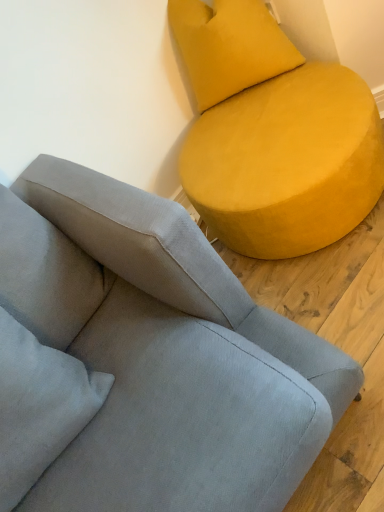
Question: From a real-world perspective, is matte yellow ottoman at upper right, the 1th studio couch when ordered from right to left, below suede gray couch at upper right, which appears as the first studio couch when viewed from the left?

Choices:
 (A) no
 (B) yes

Answer: (B)

Question: Can you confirm if matte yellow ottoman at upper right, the 1th studio couch when ordered from right to left, is bigger than suede gray couch at upper right, which appears as the first studio couch when viewed from the left?

Choices:
 (A) no
 (B) yes

Answer: (A)

Question: Is matte yellow ottoman at upper right, acting as the 2th studio couch starting from the left, turned away from suede gray couch at upper right, which appears as the first studio couch when viewed from the left?

Choices:
 (A) no
 (B) yes

Answer: (A)

Question: Is matte yellow ottoman at upper right, the 1th studio couch when ordered from right to left, completely or partially outside of suede gray couch at upper right, which is counted as the 2th studio couch, starting from the right?

Choices:
 (A) yes
 (B) no

Answer: (A)

Question: Is matte yellow ottoman at upper right, acting as the 2th studio couch starting from the left, directly adjacent to suede gray couch at upper right, which is counted as the 2th studio couch, starting from the right?

Choices:
 (A) yes
 (B) no

Answer: (B)

Question: In terms of size, does suede gray couch at upper right, which is counted as the 2th studio couch, starting from the right, appear bigger or smaller than matte yellow ottoman at upper right, acting as the 2th studio couch starting from the left?

Choices:
 (A) big
 (B) small

Answer: (A)

Question: Considering the positions of suede gray couch at upper right, which appears as the first studio couch when viewed from the left, and matte yellow ottoman at upper right, the 1th studio couch when ordered from right to left, in the image, is suede gray couch at upper right, which appears as the first studio couch when viewed from the left, taller or shorter than matte yellow ottoman at upper right, the 1th studio couch when ordered from right to left,?

Choices:
 (A) short
 (B) tall

Answer: (B)

Question: Does point (34, 204) appear closer or farther from the camera than point (342, 71)?

Choices:
 (A) farther
 (B) closer

Answer: (B)

Question: Is suede gray couch at upper right, which is counted as the 2th studio couch, starting from the right, inside the boundaries of matte yellow ottoman at upper right, acting as the 2th studio couch starting from the left, or outside?

Choices:
 (A) outside
 (B) inside

Answer: (A)

Question: Is matte yellow ottoman at upper right, acting as the 2th studio couch starting from the left, taller or shorter than suede gray couch at upper right, which appears as the first studio couch when viewed from the left?

Choices:
 (A) tall
 (B) short

Answer: (B)

Question: In the image, is matte yellow ottoman at upper right, the 1th studio couch when ordered from right to left, positioned in front of or behind suede gray couch at upper right, which is counted as the 2th studio couch, starting from the right?

Choices:
 (A) front
 (B) behind

Answer: (B)

Question: Is matte yellow ottoman at upper right, the 1th studio couch when ordered from right to left, to the left or to the right of suede gray couch at upper right, which appears as the first studio couch when viewed from the left, in the image?

Choices:
 (A) right
 (B) left

Answer: (A)

Question: Which is correct: matte yellow ottoman at upper right, acting as the 2th studio couch starting from the left, is inside suede gray couch at upper right, which appears as the first studio couch when viewed from the left, or outside of it?

Choices:
 (A) outside
 (B) inside

Answer: (A)

Question: From a real-world perspective, relative to velvet yellow pillow at upper right, is matte yellow ottoman at upper right, the 1th studio couch when ordered from right to left, vertically above or below?

Choices:
 (A) above
 (B) below

Answer: (B)

Question: Based on their positions, is matte yellow ottoman at upper right, acting as the 2th studio couch starting from the left, located to the left or right of velvet yellow pillow at upper right?

Choices:
 (A) right
 (B) left

Answer: (A)